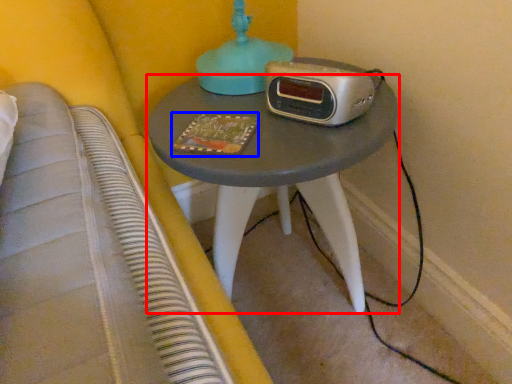
Question: Which object appears closest to the camera in this image, nightstand (highlighted by a red box) or book (highlighted by a blue box)?

Choices:
 (A) nightstand
 (B) book

Answer: (A)